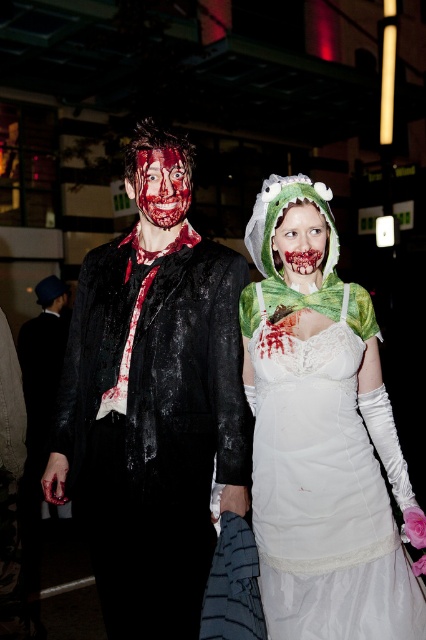
You are a photographer at a themed event and need to position two models for a photo. The models are wearing the white lace dress at center and the bloodied flesh face at center. Based on their current positions, which model should you move to the left to create a balanced composition?

The bloodied flesh face at center should be moved to the left because it is currently positioned to the left of the white lace dress at center, so moving it further left would help balance the composition with the white lace dress at center on the right.